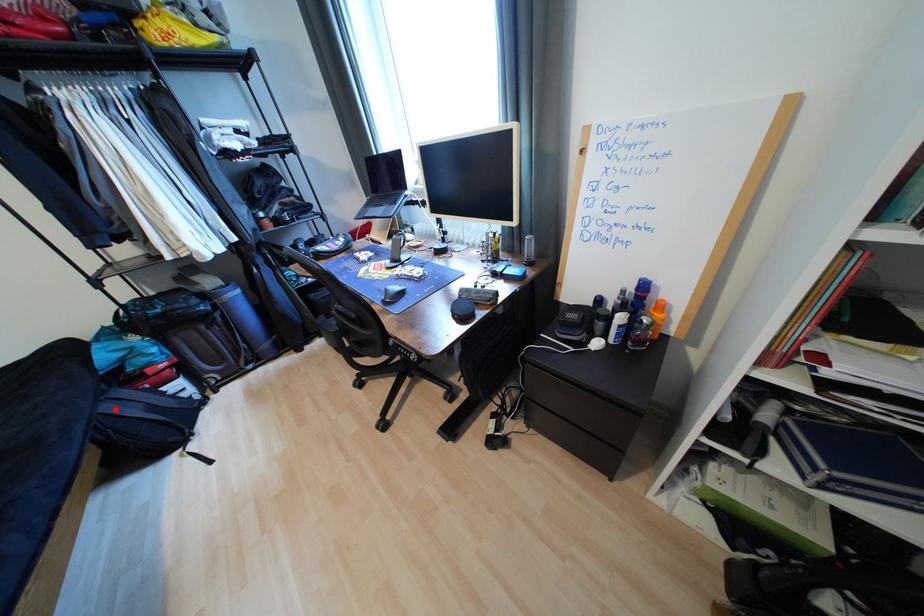
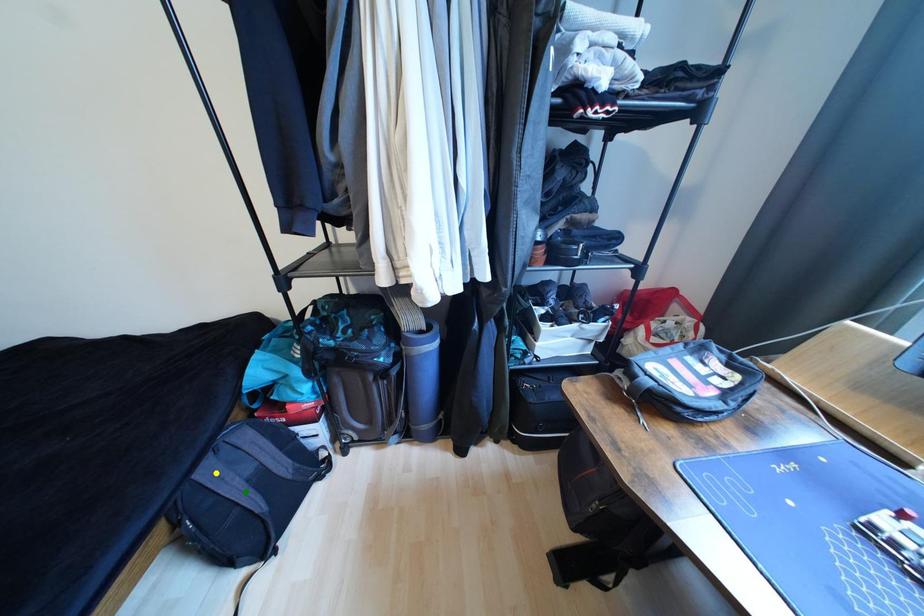
Question: I am providing you with two images of the same scene from different viewpoints. A red point is marked on the first image. You are given multiple points on the second image. In image 2, which mark is for the same physical point as the one in image 1?

Choices:
 (A) yellow point
 (B) blue point
 (C) green point

Answer: (A)